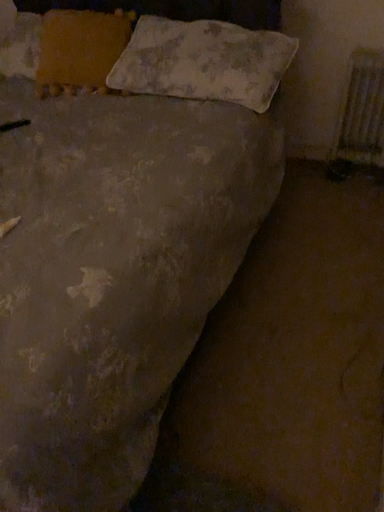
Question: Considering the relative sizes of metallic silver radiator at right and textured beige pillow at upper center, the 2th pillow positioned from the left, in the image provided, is metallic silver radiator at right wider than textured beige pillow at upper center, the 2th pillow positioned from the left,?

Choices:
 (A) no
 (B) yes

Answer: (A)

Question: Considering the relative sizes of metallic silver radiator at right and textured beige pillow at upper center, the 2th pillow positioned from the left, in the image provided, is metallic silver radiator at right thinner than textured beige pillow at upper center, the 2th pillow positioned from the left,?

Choices:
 (A) yes
 (B) no

Answer: (A)

Question: Is metallic silver radiator at right taller than textured beige pillow at upper center, the 2th pillow positioned from the left?

Choices:
 (A) yes
 (B) no

Answer: (A)

Question: From a real-world perspective, is metallic silver radiator at right located higher than textured beige pillow at upper center, the first pillow positioned from the right?

Choices:
 (A) yes
 (B) no

Answer: (B)

Question: Is metallic silver radiator at right behind textured beige pillow at upper center, the first pillow positioned from the right?

Choices:
 (A) no
 (B) yes

Answer: (B)

Question: Could you tell me if metallic silver radiator at right is turned towards textured beige pillow at upper center, the 2th pillow positioned from the left?

Choices:
 (A) no
 (B) yes

Answer: (A)

Question: Is textured beige pillow at upper center, the 2th pillow positioned from the left, positioned before metallic silver radiator at right?

Choices:
 (A) yes
 (B) no

Answer: (A)

Question: From a real-world perspective, is textured beige pillow at upper center, the 2th pillow positioned from the left, positioned under metallic silver radiator at right based on gravity?

Choices:
 (A) no
 (B) yes

Answer: (A)

Question: Is textured beige pillow at upper center, the first pillow positioned from the right, smaller than metallic silver radiator at right?

Choices:
 (A) no
 (B) yes

Answer: (A)

Question: Is textured beige pillow at upper center, the first pillow positioned from the right, wider than metallic silver radiator at right?

Choices:
 (A) yes
 (B) no

Answer: (A)

Question: Is textured beige pillow at upper center, the 2th pillow positioned from the left, facing away from metallic silver radiator at right?

Choices:
 (A) yes
 (B) no

Answer: (B)

Question: Can you confirm if textured beige pillow at upper center, the first pillow positioned from the right, is thinner than metallic silver radiator at right?

Choices:
 (A) no
 (B) yes

Answer: (A)

Question: Could you tell me if metallic silver radiator at right is facing orange fabric pillow at upper left, acting as the first pillow starting from the left?

Choices:
 (A) yes
 (B) no

Answer: (B)